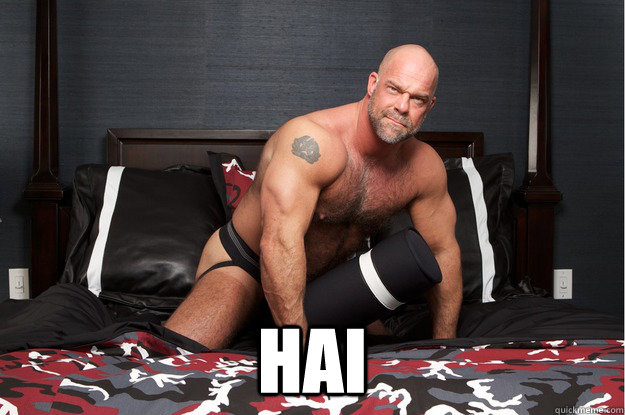
You are a GUI agent. You are given a task and a screenshot of the screen. Output one action in this format:
    pyautogui.click(x=<x>, y=<y>)
    Task: Click on the bed
    
    Given the screenshot: What is the action you would take?
    pyautogui.click(x=489, y=392)